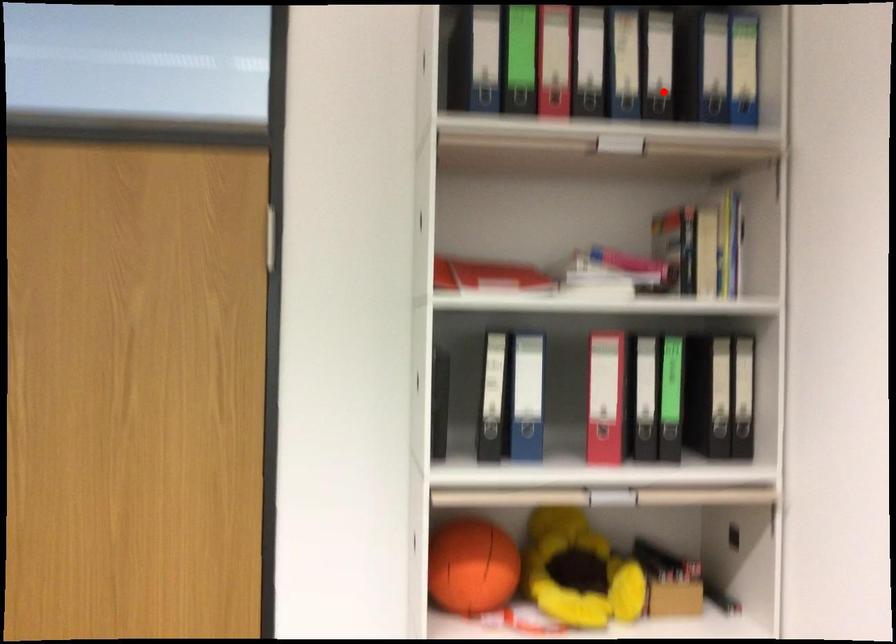
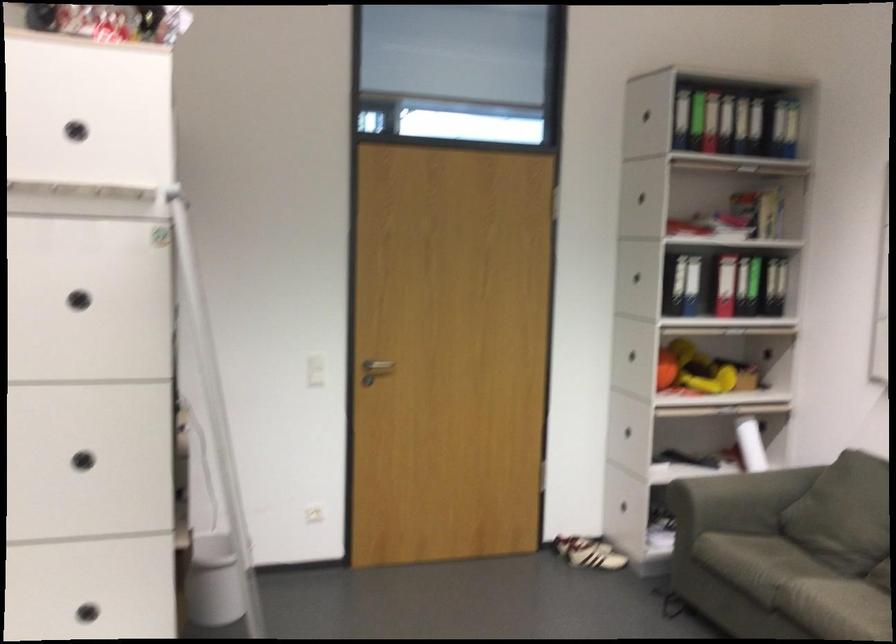
Question: I am providing you with two images of the same scene from different viewpoints. A red point is shown in image1. For the corresponding object point in image2, is it positioned nearer or farther from the camera?

Choices:
 (A) Nearer
 (B) Farther

Answer: (B)